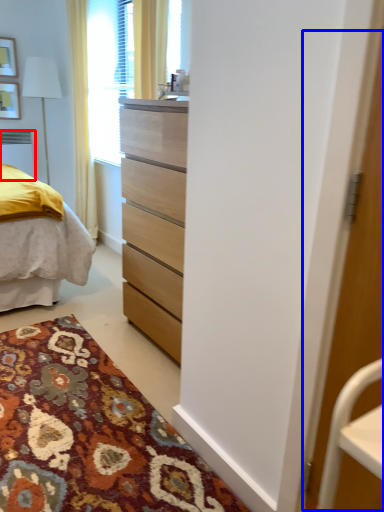
Question: Which object is closer to the camera taking this photo, radiator (highlighted by a red box) or screen door (highlighted by a blue box)?

Choices:
 (A) radiator
 (B) screen door

Answer: (B)